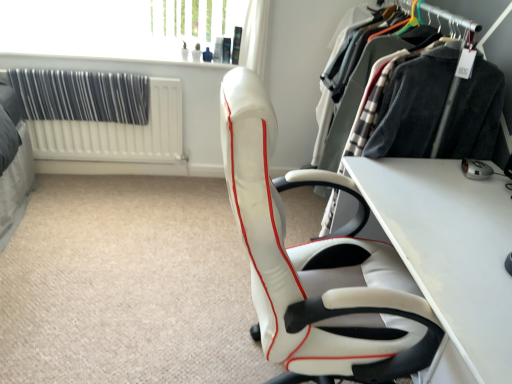
Question: In terms of height, does white textured radiator at left look taller or shorter compared to white glossy table at center?

Choices:
 (A) short
 (B) tall

Answer: (A)

Question: Is white textured radiator at left in front of or behind white glossy table at center in the image?

Choices:
 (A) behind
 (B) front

Answer: (A)

Question: Estimate the real-world distances between objects in this image. Which object is farther from the transparent glass window screen at upper center?

Choices:
 (A) black fabric curtain at upper left
 (B) white leather chair at center
 (C) white textured radiator at left
 (D) velvet black coat at right
 (E) white glossy table at center

Answer: (E)

Question: Estimate the real-world distances between objects in this image. Which object is closer to the white leather chair at center?

Choices:
 (A) velvet black coat at right
 (B) silver metallic mouse at lower right
 (C) white textured radiator at left
 (D) white glossy table at center
 (E) black fabric curtain at upper left

Answer: (D)